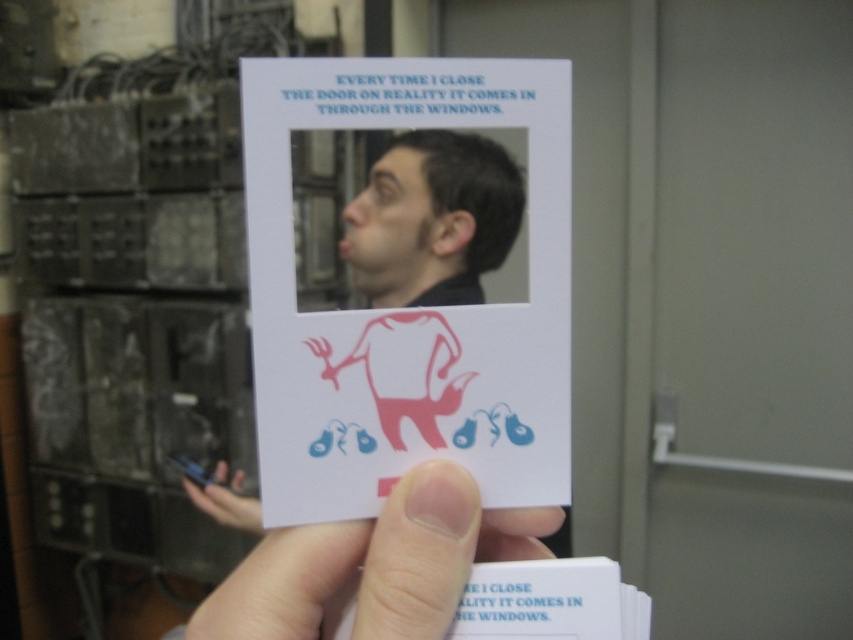
You are looking at the card in the image. There are two points marked on it. The first point is at coordinates point (408, 522) and the second point is at point (415, 150). Which point is closer to you?

Point (408, 522) is in front of point (415, 150), so it is closer to you.

Consider the image. What is located at the coordinates point (375, 563) on the card?

The coordinates point (375, 563) on the card correspond to flesh toned skin at lower center.